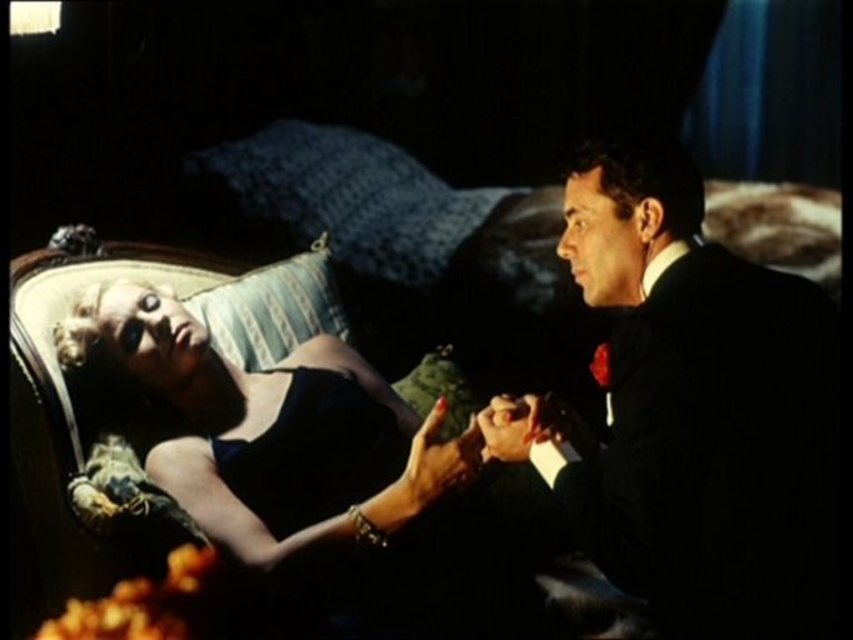
Which is above, shiny black dress at center or shiny black suit at right?

shiny black dress at center is above.

Between shiny black dress at center and shiny black suit at right, which one has less height?

shiny black suit at right is shorter.

Where is `shiny black dress at center`? The image size is (853, 640). shiny black dress at center is located at coordinates (527, 429).

At what (x,y) coordinates should I click in order to perform the action: click on shiny black dress at center. Please return your answer as a coordinate pair (x, y). Looking at the image, I should click on (527, 429).

Between point (618, 420) and point (363, 596), which one is positioned in front?

Point (618, 420) is in front.

Is point (584, 163) farther from viewer compared to point (300, 400)?

No, (584, 163) is in front of (300, 400).

Is point (674, 310) positioned before point (189, 436)?

Yes, point (674, 310) is closer to viewer.

The height and width of the screenshot is (640, 853). I want to click on shiny black suit at right, so click(x=698, y=406).

Which is behind, point (614, 385) or point (527, 513)?

Point (527, 513)

Is shiny black dress at center below matte black dress at center?

No.

Find the location of `shiny black dress at center`. shiny black dress at center is located at coordinates (527, 429).

Where is `shiny black dress at center`? shiny black dress at center is located at coordinates (527, 429).